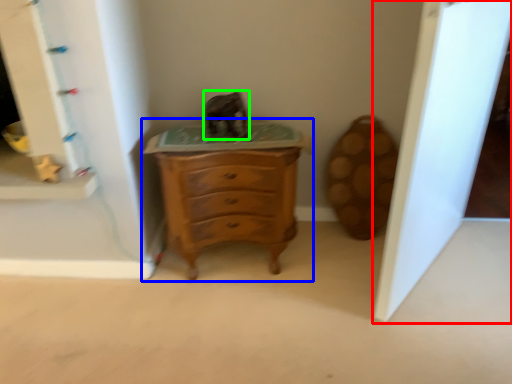
Question: Which object is the closest to the glass door (highlighted by a red box)? Choose among these: chest of drawers (highlighted by a blue box) or animal (highlighted by a green box).

Choices:
 (A) chest of drawers
 (B) animal

Answer: (A)